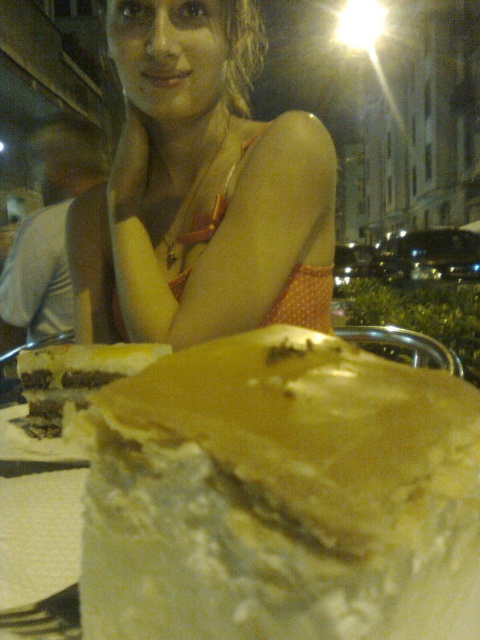
Question: Does white creamy cake at center appear under yellow cake at center?

Choices:
 (A) yes
 (B) no

Answer: (A)

Question: Considering the real-world distances, which object is closest to the yellow cake at center?

Choices:
 (A) orange polka dot dress at upper center
 (B) white creamy cake at center

Answer: (B)

Question: Can you confirm if white creamy cake at center is positioned above orange polka dot dress at upper center?

Choices:
 (A) no
 (B) yes

Answer: (A)

Question: Does white creamy cake at center appear on the left side of yellow cake at center?

Choices:
 (A) no
 (B) yes

Answer: (A)

Question: Which object is farther from the camera taking this photo?

Choices:
 (A) yellow cake at center
 (B) orange polka dot dress at upper center
 (C) white creamy cake at center

Answer: (B)

Question: Among these objects, which one is nearest to the camera?

Choices:
 (A) orange polka dot dress at upper center
 (B) white creamy cake at center

Answer: (B)